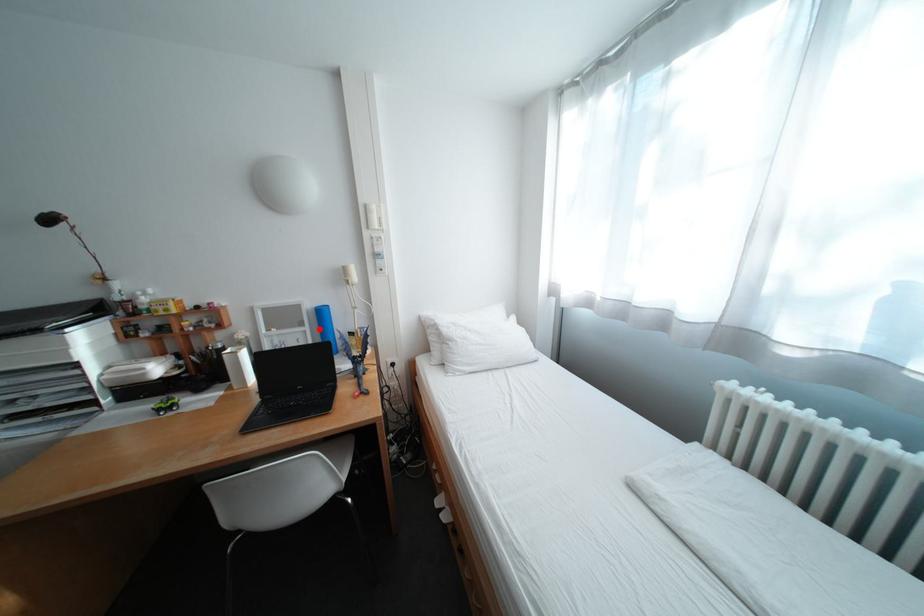
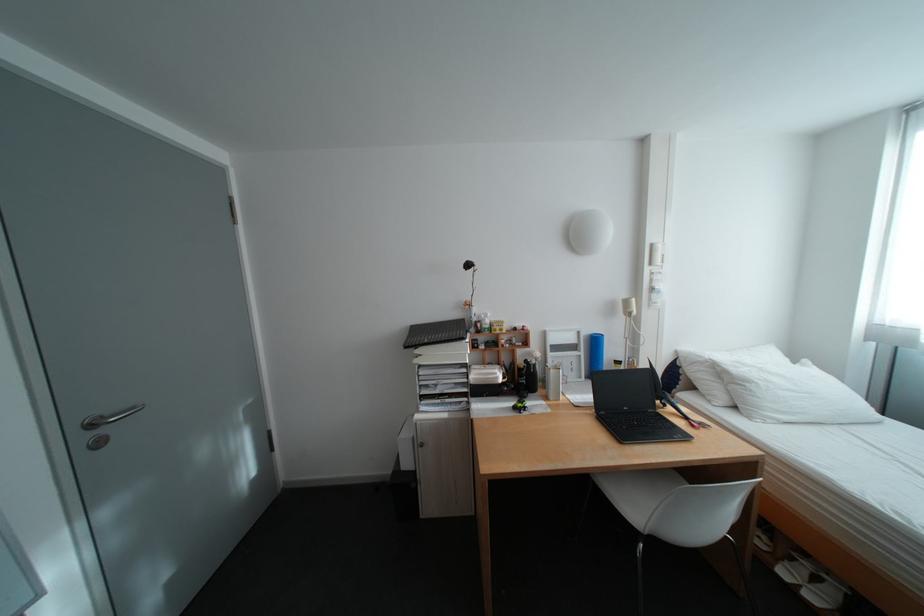
Question: I am providing you with two images of the same scene from different viewpoints. A red point is shown in image1. For the corresponding object point in image2, is it positioned nearer or farther from the camera?

Choices:
 (A) Nearer
 (B) Farther

Answer: (B)